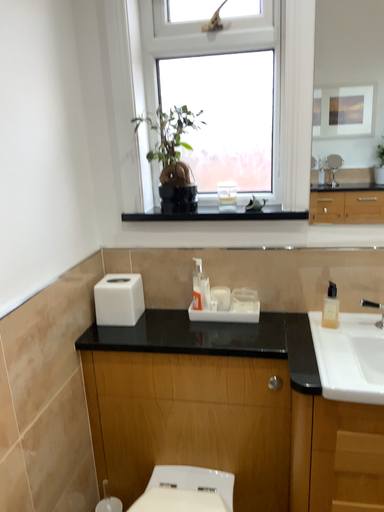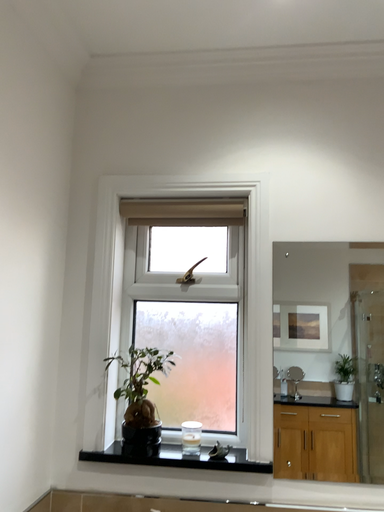
Question: How did the camera likely rotate when shooting the video?

Choices:
 (A) rotated downward
 (B) rotated upward

Answer: (B)